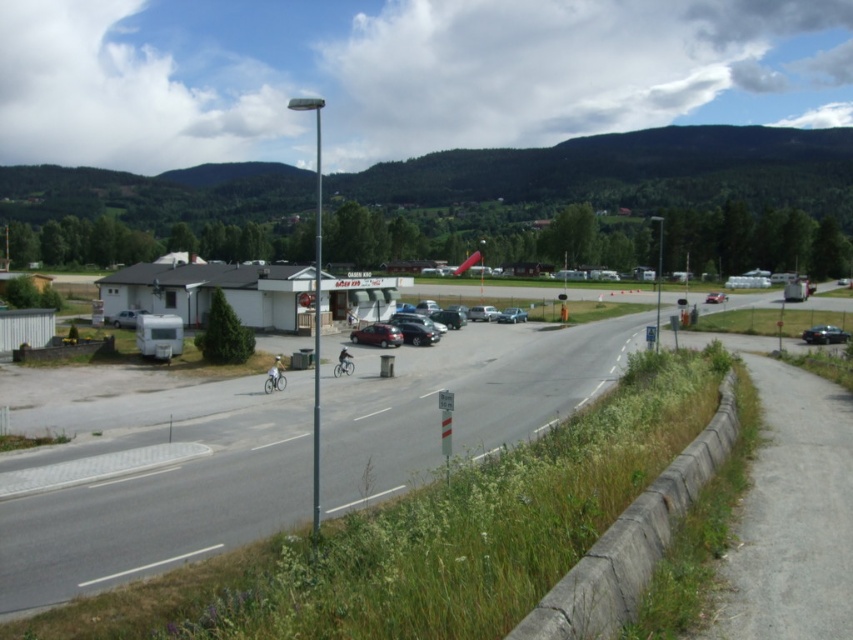
Does white matte bicycle at center have a lesser width compared to satin silver sedan at center?

Yes, white matte bicycle at center is thinner than satin silver sedan at center.

Is white matte bicycle at center wider than satin silver sedan at center?

In fact, white matte bicycle at center might be narrower than satin silver sedan at center.

Which is behind, point (267, 378) or point (512, 314)?

Positioned behind is point (512, 314).

What are the coordinates of `white matte bicycle at center` in the screenshot? It's located at (276, 376).

Which is in front, point (352, 337) or point (808, 342)?

Point (352, 337) is more forward.

Which is more to the right, shiny metallic car at center or metallic dark gray car at center-right?

From the viewer's perspective, metallic dark gray car at center-right appears more on the right side.

Where is `shiny metallic car at center`? shiny metallic car at center is located at coordinates (376, 336).

Can you confirm if shiny metallic car at center is thinner than satin silver sedan at center?

No, shiny metallic car at center is not thinner than satin silver sedan at center.

You are a GUI agent. You are given a task and a screenshot of the screen. Output one action in this format:
    pyautogui.click(x=<x>, y=<y>)
    Task: Click on the shiny metallic car at center
    This screenshot has height=640, width=853.
    Given the screenshot: What is the action you would take?
    pyautogui.click(x=376, y=336)

This screenshot has height=640, width=853. Identify the location of shiny metallic car at center. (376, 336).